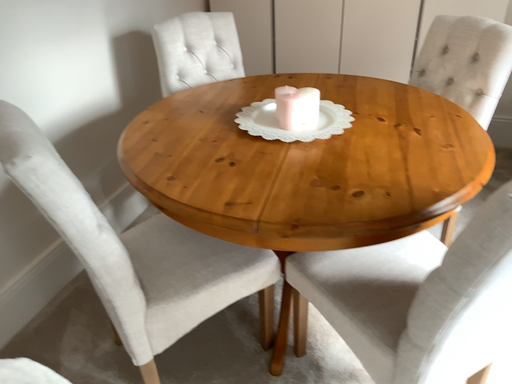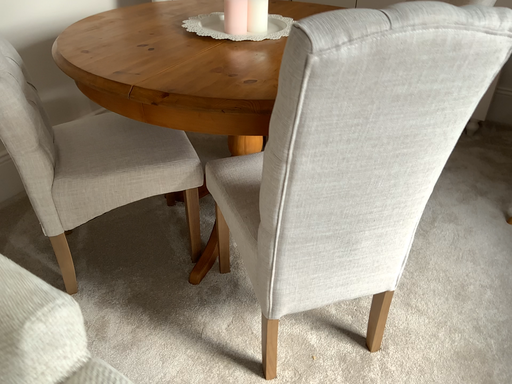
Question: Which way did the camera rotate in the video?

Choices:
 (A) rotated left
 (B) rotated right

Answer: (A)